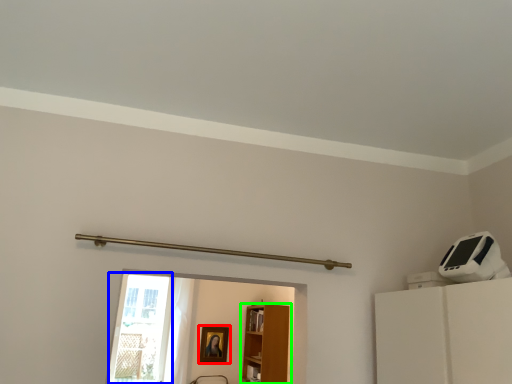
Question: Estimate the real-world distances between objects in this image. Which object is farther from picture frame (highlighted by a red box), glass door (highlighted by a blue box) or furniture (highlighted by a green box)?

Choices:
 (A) glass door
 (B) furniture

Answer: (A)